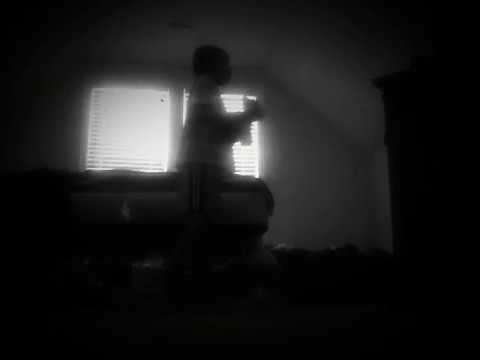
Locate an element on the screen. This screenshot has height=360, width=480. wall is located at coordinates (329, 145).